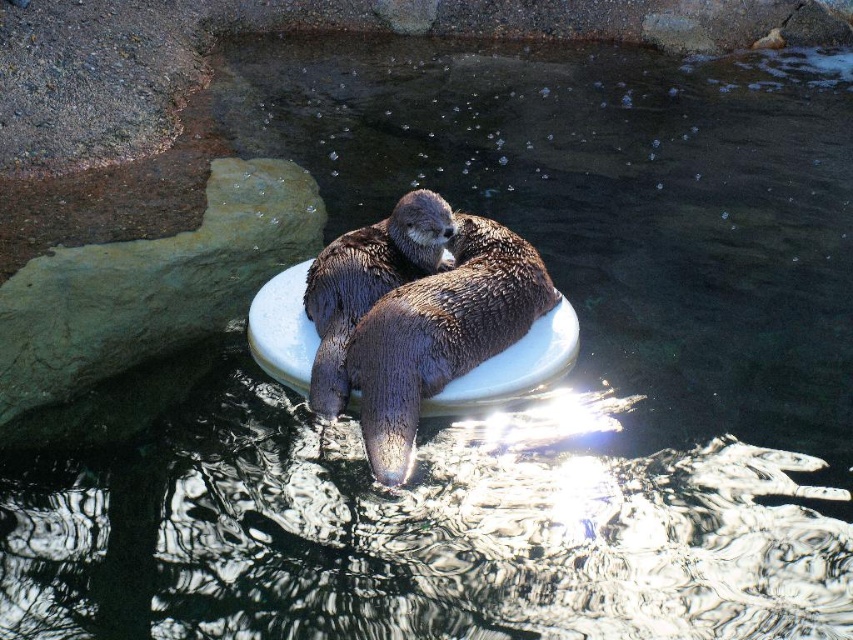
Question: Can you confirm if brown fuzzy otter at center is smaller than shiny brown otter at center?

Choices:
 (A) no
 (B) yes

Answer: (A)

Question: Does brown fuzzy otter at center appear over shiny brown otter at center?

Choices:
 (A) no
 (B) yes

Answer: (A)

Question: Which object is closer to the camera taking this photo?

Choices:
 (A) brown fuzzy otter at center
 (B) shiny brown otter at center

Answer: (A)

Question: Is brown fuzzy otter at center to the right of shiny brown otter at center from the viewer's perspective?

Choices:
 (A) no
 (B) yes

Answer: (B)

Question: Which object appears closest to the camera in this image?

Choices:
 (A) brown fuzzy otter at center
 (B) shiny brown otter at center

Answer: (A)

Question: Which of the following is the closest to the observer?

Choices:
 (A) brown fuzzy otter at center
 (B) shiny brown otter at center

Answer: (A)